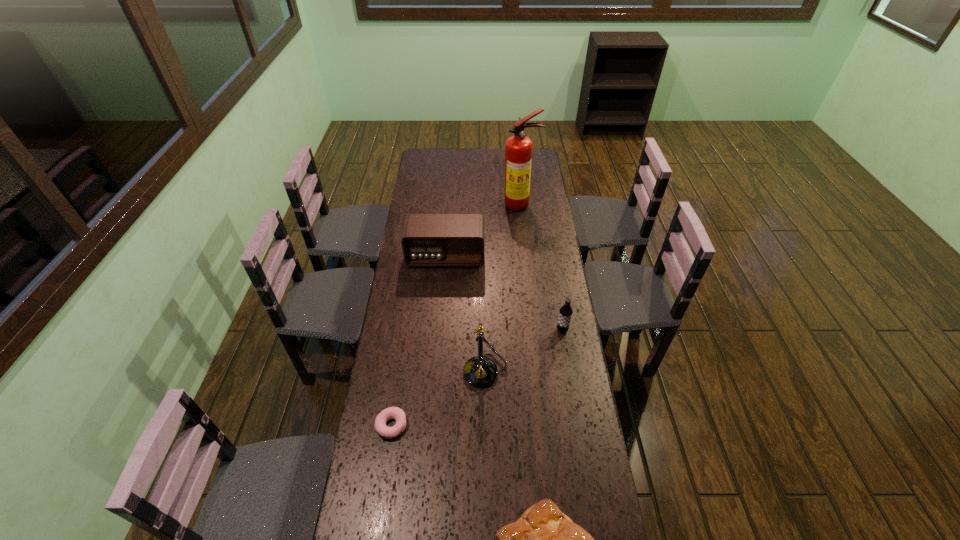
In order to click on vacant area situated 0.210m on the dial of the telephone in this screenshot , I will do `click(405, 371)`.

I want to click on vacant space located on the dial of the telephone, so click(x=430, y=371).

The height and width of the screenshot is (540, 960). I want to click on vacant space located on the dial of the telephone, so click(x=449, y=371).

In order to click on free space located on the front of the doughnut in this screenshot , I will do `click(386, 466)`.

At what (x,y) coordinates should I click in order to perform the action: click on radio receiver present at the left edge. Please return your answer as a coordinate pair (x, y). The width and height of the screenshot is (960, 540). Looking at the image, I should click on (429, 240).

Locate an element on the screen. The width and height of the screenshot is (960, 540). doughnut positioned at the left edge is located at coordinates (396, 413).

Where is `fire extinguisher present at the right edge`? fire extinguisher present at the right edge is located at coordinates pyautogui.click(x=518, y=149).

Image resolution: width=960 pixels, height=540 pixels. Identify the location of root beer at the right edge. (565, 314).

The height and width of the screenshot is (540, 960). In the image, there is a desktop. What are the coordinates of `free space at the far edge` in the screenshot? It's located at (471, 152).

In order to click on vacant space at the left edge of the desktop in this screenshot , I will do `click(419, 207)`.